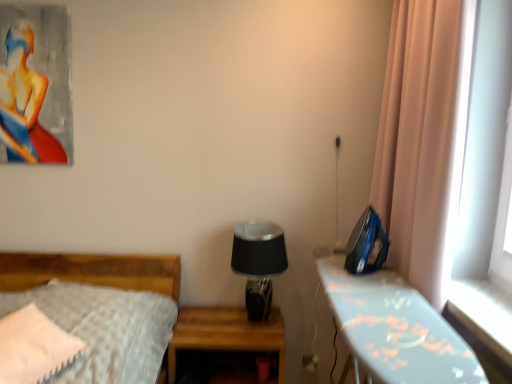
Where is `vacant space situated on the left part of black glass table lamp at center`? vacant space situated on the left part of black glass table lamp at center is located at coordinates (207, 322).